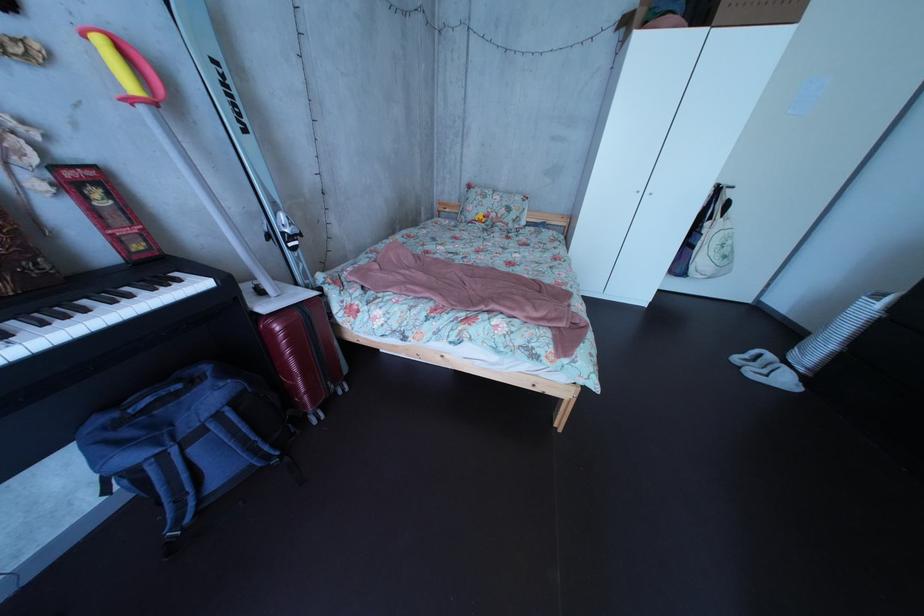
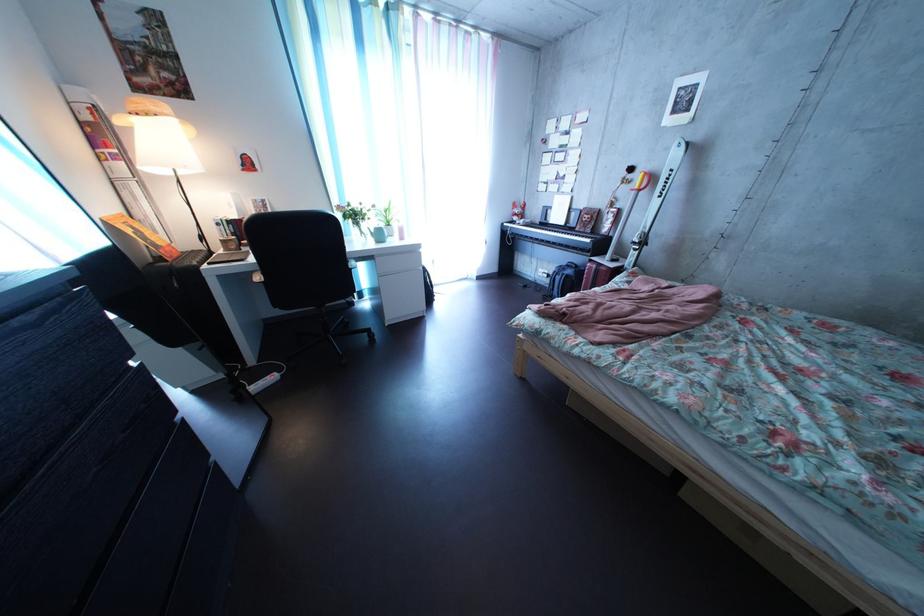
Locate, in the second image, the point that corresponds to [307,246] in the first image.

(648, 252)